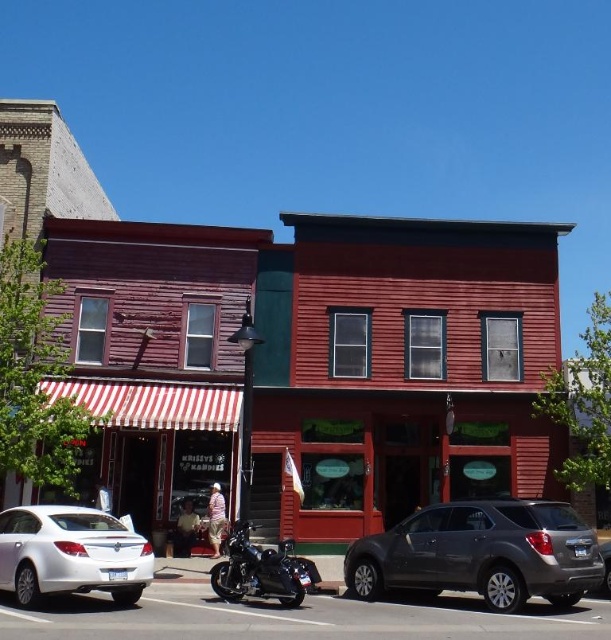
Looking at this image, does matte gray suv at lower right have a greater height compared to matte gray suv at center?

Yes.

Measure the distance from matte gray suv at lower right to matte gray suv at center.

matte gray suv at lower right is 6.55 feet away from matte gray suv at center.

Which is in front, point (346, 589) or point (606, 593)?

Point (606, 593) is more forward.

Identify the location of matte gray suv at lower right. The image size is (611, 640). (480, 554).

Can you confirm if black matte motorcycle at center is positioned to the left of matte gray suv at center?

Yes, black matte motorcycle at center is to the left of matte gray suv at center.

Can you confirm if black matte motorcycle at center is bigger than matte gray suv at center?

Yes.

Who is more distant from viewer, (233, 529) or (609, 592)?

Point (233, 529)

Image resolution: width=611 pixels, height=640 pixels. What are the coordinates of `black matte motorcycle at center` in the screenshot? It's located at (260, 570).

Who is more distant from viewer, (467, 509) or (174, 500)?

Positioned behind is point (174, 500).

Is matte gray suv at lower right taller than metallic silver car at center?

Yes.

Where is `matte gray suv at lower right`? The width and height of the screenshot is (611, 640). matte gray suv at lower right is located at coordinates (480, 554).